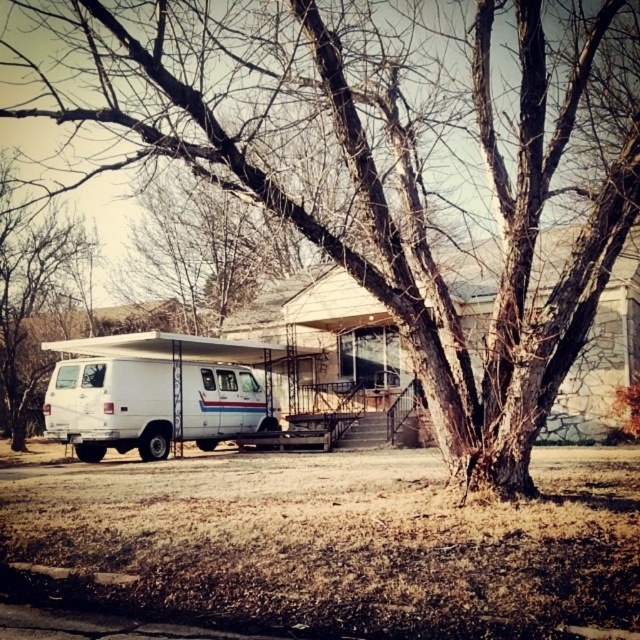
Question: Can you confirm if white matte van at lower left is wider than bare wood tree at left?

Choices:
 (A) no
 (B) yes

Answer: (A)

Question: Is white matte van at lower left wider than bare wood tree at left?

Choices:
 (A) yes
 (B) no

Answer: (B)

Question: Which point is farther from the camera taking this photo?

Choices:
 (A) coord(204,369)
 (B) coord(45,221)

Answer: (B)

Question: Is white matte van at lower left above bare wood tree at left?

Choices:
 (A) no
 (B) yes

Answer: (A)